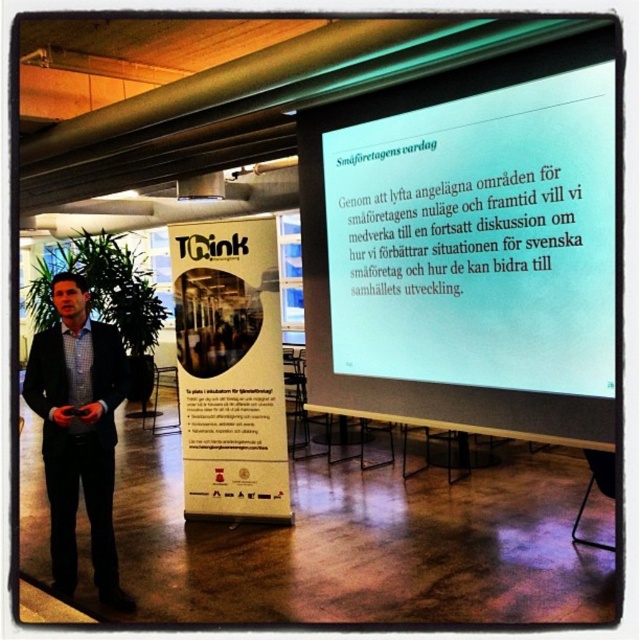
Between white matte projection screen at upper center and dark blue suit at left, which one appears on the right side from the viewer's perspective?

From the viewer's perspective, white matte projection screen at upper center appears more on the right side.

Can you confirm if white matte projection screen at upper center is smaller than dark blue suit at left?

No, white matte projection screen at upper center is not smaller than dark blue suit at left.

I want to click on white matte projection screen at upper center, so click(465, 252).

The image size is (640, 640). Identify the location of white matte projection screen at upper center. (465, 252).

Find the location of a particular element. The height and width of the screenshot is (640, 640). white matte projection screen at upper center is located at coordinates (465, 252).

I want to click on white matte projection screen at upper center, so click(465, 252).

Which is behind, point (240, 384) or point (67, 468)?

Point (240, 384)

Find the location of a particular element. The width and height of the screenshot is (640, 640). white cardboard poster at center is located at coordinates (230, 369).